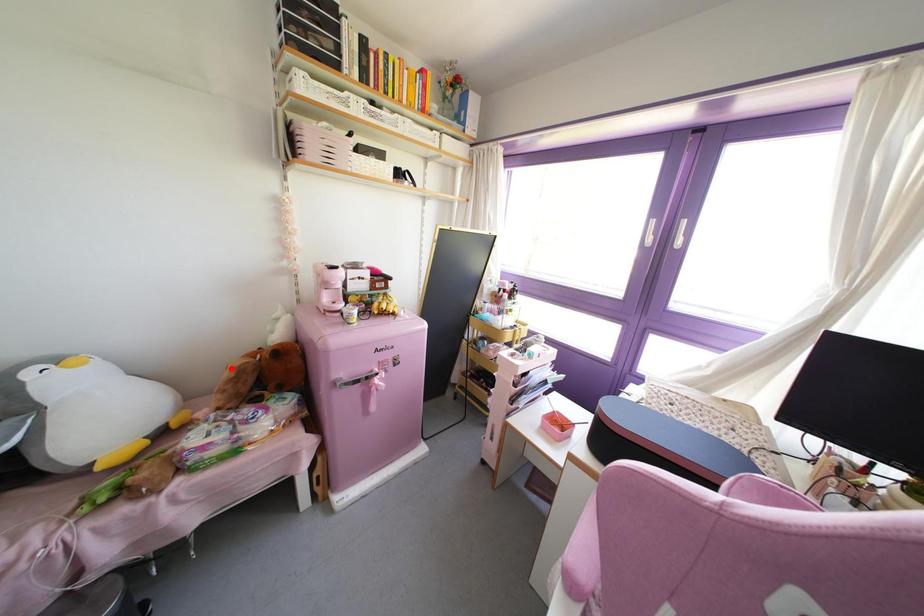
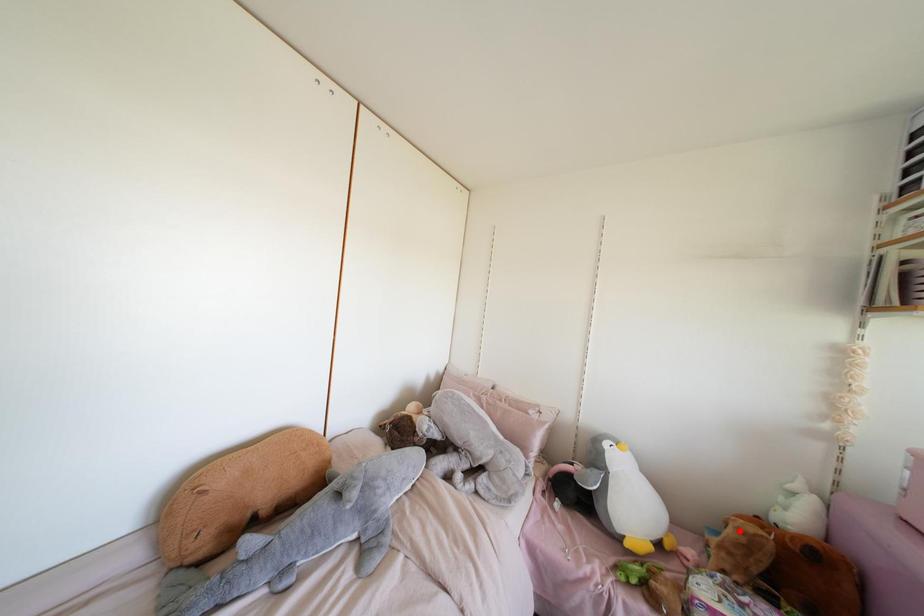
I am providing you with two images of the same scene from different viewpoints. A red point is marked on the first image and another point is marked on the second image. Does the point marked in image1 correspond to the same location as the one in image2?

Yes